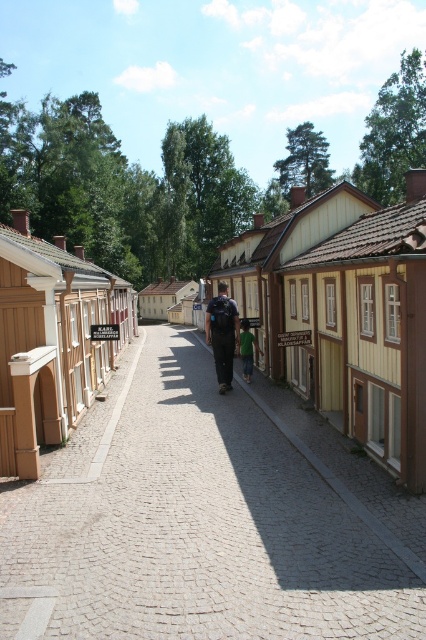
You are standing on the cobblestone street and see the brown wooden houses at center and the dark blue fabric backpack at center. Which object is positioned to the left of the other?

The brown wooden houses at center are to the left of the dark blue fabric backpack at center.

You are a tourist standing on the cobblestone street and want to take a photo of the brown wooden houses at center and the green fabric shirt at center. Which object should you focus on first if you want to capture both in a single frame without moving the camera?

The brown wooden houses at center should be focused on first because their width is larger than the green fabric shirt at center, making them more prominent in the frame.